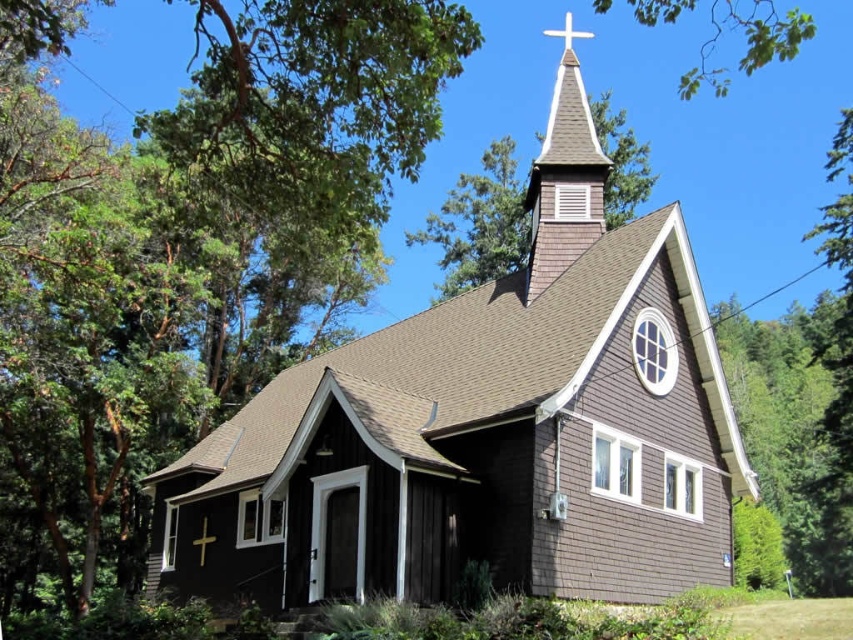
Can you confirm if brown shingles church at center is shorter than gold metallic cross at center?

In fact, brown shingles church at center may be taller than gold metallic cross at center.

Does brown shingles church at center have a greater height compared to gold metallic cross at center?

Correct, brown shingles church at center is much taller as gold metallic cross at center.

Who is more forward, (x=602, y=392) or (x=204, y=556)?

Point (x=602, y=392)

The width and height of the screenshot is (853, 640). What are the coordinates of `brown shingles church at center` in the screenshot? It's located at (486, 429).

Is brown shingles at upper center to the left of gold metallic cross at center from the viewer's perspective?

In fact, brown shingles at upper center is to the right of gold metallic cross at center.

Does brown shingles at upper center have a greater width compared to gold metallic cross at center?

Yes, brown shingles at upper center is wider than gold metallic cross at center.

Between point (560, 102) and point (201, 536), which one is positioned in front?

Point (201, 536) is more forward.

This screenshot has width=853, height=640. In order to click on brown shingles at upper center in this screenshot , I will do `click(564, 177)`.

Can you confirm if brown shingles church at center is taller than brown shingles at upper center?

No.

Does brown shingles church at center appear on the left side of brown shingles at upper center?

Indeed, brown shingles church at center is positioned on the left side of brown shingles at upper center.

Does point (711, 454) come farther from viewer compared to point (572, 49)?

No.

Where is `brown shingles church at center`? This screenshot has height=640, width=853. brown shingles church at center is located at coordinates (486, 429).